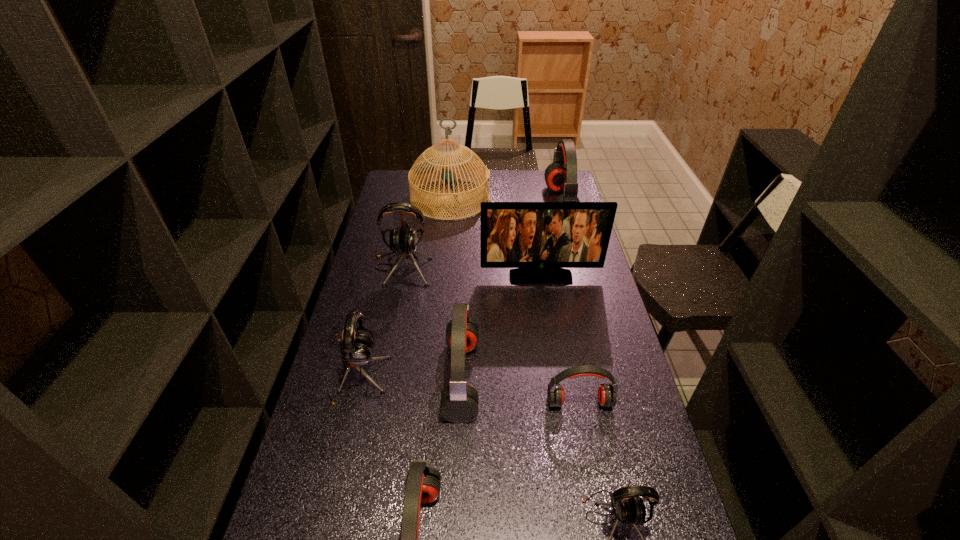
Locate an element on the screen. free space located on the right of the birdcage is located at coordinates (574, 199).

Identify the location of blank space located 0.230m on the front-facing side of the monitor. The width and height of the screenshot is (960, 540). (549, 331).

At what (x,y) coordinates should I click in order to perform the action: click on vacant area situated 0.050m on the ear cups of the farthest earphone. Please return your answer as a coordinate pair (x, y). This screenshot has width=960, height=540. Looking at the image, I should click on (537, 205).

In order to click on vacant space positioned 0.150m on the ear cups of the farthest earphone in this screenshot , I will do `click(515, 205)`.

Find the location of a particular element. free point located on the ear cups of the farthest earphone is located at coordinates (484, 205).

This screenshot has height=540, width=960. What are the coordinates of `free space located on the front of the biggest black earphone` in the screenshot? It's located at (387, 342).

The width and height of the screenshot is (960, 540). In order to click on free space located 0.320m on the ear cups of the third smallest red earphone in this screenshot , I will do `click(588, 378)`.

Locate an element on the screen. The image size is (960, 540). free space located on the front of the second biggest black earphone is located at coordinates (329, 495).

The width and height of the screenshot is (960, 540). In order to click on free location located 0.240m on the ear cups of the smallest red earphone in this screenshot , I will do `click(599, 502)`.

Locate an element on the screen. birdcage at the far edge is located at coordinates (425, 166).